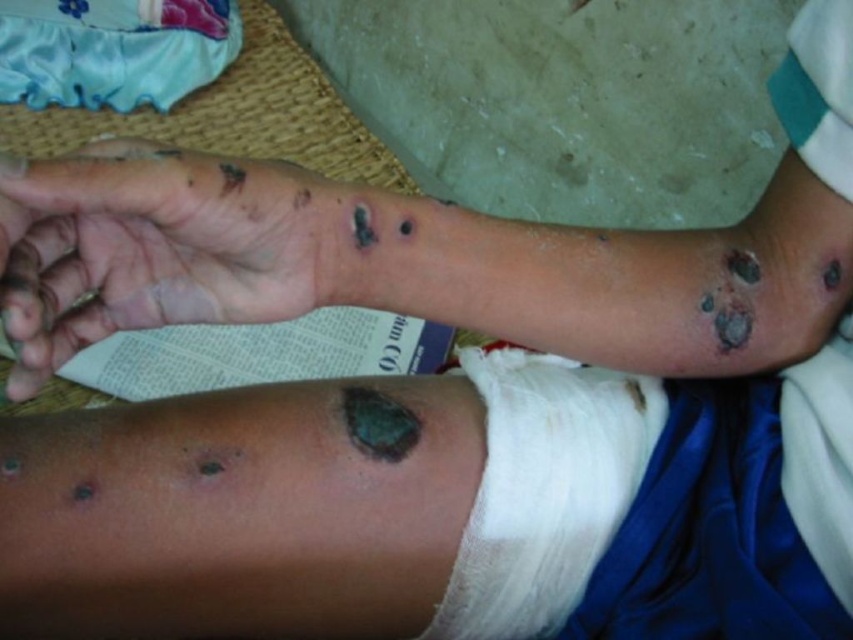
Between black matte skin at lower left and white cotton bandage at lower center, which one is positioned higher?

black matte skin at lower left

Can you confirm if black matte skin at lower left is positioned below white cotton bandage at lower center?

Actually, black matte skin at lower left is above white cotton bandage at lower center.

Is point (282, 237) farther from viewer compared to point (556, 376)?

No, it is in front of (556, 376).

This screenshot has width=853, height=640. I want to click on black matte skin at lower left, so click(x=154, y=246).